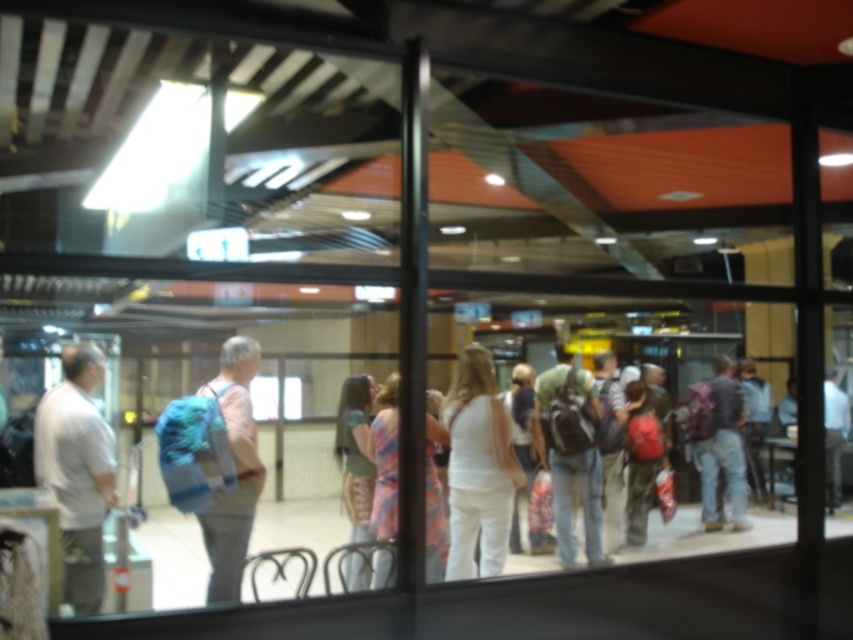
Question: Which point is farther to the camera?

Choices:
 (A) (376, 499)
 (B) (830, 436)
 (C) (247, 444)
 (D) (88, 520)

Answer: (B)

Question: Where is white matte shirt at left located in relation to light brown fabric dress at center in the image?

Choices:
 (A) left
 (B) right

Answer: (A)

Question: Which is farther from the white matte shirt at left?

Choices:
 (A) plaid fabric dress at center
 (B) light brown fabric dress at center

Answer: (B)

Question: Which point appears closest to the camera in this image?

Choices:
 (A) (387, 496)
 (B) (351, 376)

Answer: (A)

Question: Does white cotton pants at center appear on the right side of light brown fabric dress at center?

Choices:
 (A) yes
 (B) no

Answer: (A)

Question: Is white matte shirt at left thinner than matte gray backpack at center?

Choices:
 (A) yes
 (B) no

Answer: (A)